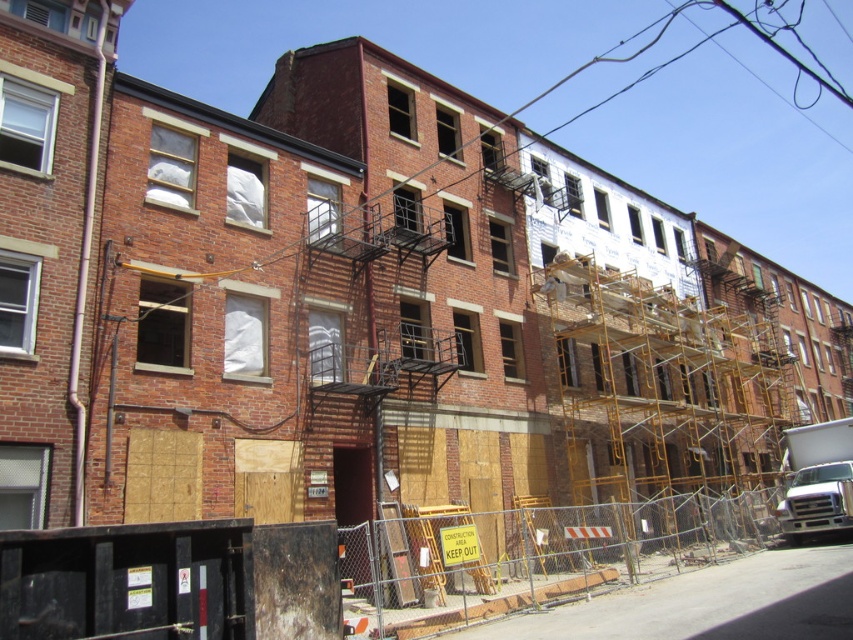
Can you confirm if yellow metal scaffolding at center is bigger than metal mesh fence at lower center?

Correct, yellow metal scaffolding at center is larger in size than metal mesh fence at lower center.

Which is more to the left, yellow metal scaffolding at center or metal mesh fence at lower center?

From the viewer's perspective, metal mesh fence at lower center appears more on the left side.

Which is behind, point (717, 424) or point (679, 512)?

The point (717, 424) is more distant.

What are the coordinates of `yellow metal scaffolding at center` in the screenshot? It's located at (659, 387).